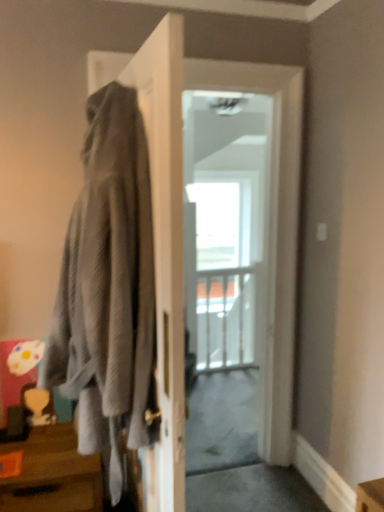
In order to face white glossy door at center, should I rotate leftwards or rightwards?

To align with it, rotate right about 1.968°.

What is the approximate width of transparent glass door at center?

3.12 inches.

Describe the element at coordinates (222, 270) in the screenshot. The width and height of the screenshot is (384, 512). I see `transparent glass door at center` at that location.

Locate an element on the screen. white glossy door at center is located at coordinates (182, 233).

Is white glossy door at center further to the viewer compared to gray textured hoodie at left?

Yes.

Is white glossy door at center inside or outside of gray textured hoodie at left?

white glossy door at center is spatially situated outside gray textured hoodie at left.

Could you tell me if white glossy door at center is facing gray textured hoodie at left?

No, white glossy door at center is not aimed at gray textured hoodie at left.

How far apart are transparent glass door at center and gray textured hoodie at left?

The distance of transparent glass door at center from gray textured hoodie at left is 3.00 meters.

Is transparent glass door at center turned away from gray textured hoodie at left?

That's not correct — transparent glass door at center is not looking away from gray textured hoodie at left.

Which is more to the left, transparent glass door at center or gray textured hoodie at left?

gray textured hoodie at left.

Image resolution: width=384 pixels, height=512 pixels. In order to click on glass door below the gray textured hoodie at left (from a real-world perspective) in this screenshot , I will do `click(222, 270)`.

Does white glossy door at center appear on the right side of brown wood table at lower left?

Indeed, white glossy door at center is positioned on the right side of brown wood table at lower left.

From a real-world perspective, which object rests below the other?

In real-world perspective, brown wood table at lower left is lower.

Which object is thinner, white glossy door at center or brown wood table at lower left?

white glossy door at center is thinner.

In the scene shown: How much distance is there between gray textured hoodie at left and white glossy door at center?

The distance of gray textured hoodie at left from white glossy door at center is 96.00 centimeters.

Considering the sizes of objects gray textured hoodie at left and white glossy door at center in the image provided, who is smaller, gray textured hoodie at left or white glossy door at center?

white glossy door at center.

From a real-world perspective, is gray textured hoodie at left located beneath white glossy door at center?

Actually, gray textured hoodie at left is physically above white glossy door at center in the real world.

Would you say gray textured hoodie at left is a long distance from white glossy door at center?

That's not correct — gray textured hoodie at left is a little close to white glossy door at center.

What's the angular difference between brown wood table at lower left and transparent glass door at center's facing directions?

The facing directions of brown wood table at lower left and transparent glass door at center are 1.34 degrees apart.

Which of these two, brown wood table at lower left or transparent glass door at center, is bigger?

transparent glass door at center is bigger.

Does brown wood table at lower left contain transparent glass door at center?

No, transparent glass door at center is located outside of brown wood table at lower left.

Is brown wood table at lower left not near transparent glass door at center?

Indeed, brown wood table at lower left is not near transparent glass door at center.

Which is more to the right, gray textured hoodie at left or transparent glass door at center?

transparent glass door at center is more to the right.

Relative to transparent glass door at center, is gray textured hoodie at left in front or behind?

In the image, gray textured hoodie at left appears in front of transparent glass door at center.

From a real-world perspective, does gray textured hoodie at left sit lower than transparent glass door at center?

No, from a real-world perspective, gray textured hoodie at left is not beneath transparent glass door at center.

Can we say gray textured hoodie at left lies outside transparent glass door at center?

Yes, gray textured hoodie at left is not within transparent glass door at center.

Is gray textured hoodie at left oriented away from brown wood table at lower left?

No.

From a real-world perspective, is gray textured hoodie at left positioned above or below brown wood table at lower left?

gray textured hoodie at left is above brown wood table at lower left.

From the image's perspective, is gray textured hoodie at left under brown wood table at lower left?

No.

Would you say brown wood table at lower left is part of gray textured hoodie at left's contents?

No.

Identify the location of laundry below the white glossy door at center (from the image's perspective). This screenshot has height=512, width=384. (108, 287).

This screenshot has width=384, height=512. Identify the location of laundry above the transparent glass door at center (from a real-world perspective). (108, 287).

Estimate the real-world distances between objects in this image. Which object is further from gray textured hoodie at left, white glossy door at center or brown wood table at lower left?

Based on the image, white glossy door at center appears to be further to gray textured hoodie at left.

When comparing their distances from white glossy door at center, does brown wood table at lower left or transparent glass door at center seem closer?

The object closer to white glossy door at center is brown wood table at lower left.

Which object lies further to the anchor point brown wood table at lower left, white glossy door at center or transparent glass door at center?

transparent glass door at center.

Looking at the image, which one is located closer to gray textured hoodie at left, white glossy door at center or transparent glass door at center?

Among the two, white glossy door at center is located nearer to gray textured hoodie at left.

From the image, which object appears to be nearer to white glossy door at center, brown wood table at lower left or gray textured hoodie at left?

gray textured hoodie at left is positioned closer to the anchor white glossy door at center.

When comparing their distances from brown wood table at lower left, does white glossy door at center or gray textured hoodie at left seem closer?

gray textured hoodie at left is closer to brown wood table at lower left.

Looking at the image, which one is located further to brown wood table at lower left, gray textured hoodie at left or transparent glass door at center?

Based on the image, transparent glass door at center appears to be further to brown wood table at lower left.

Which object lies further to the anchor point gray textured hoodie at left, transparent glass door at center or white glossy door at center?

transparent glass door at center.

Identify the location of laundry between white glossy door at center and brown wood table at lower left in the up-down direction. This screenshot has width=384, height=512. (108, 287).

Where is `door between brown wood table at lower left and transparent glass door at center from front to back`? Image resolution: width=384 pixels, height=512 pixels. door between brown wood table at lower left and transparent glass door at center from front to back is located at coordinates (182, 233).

Locate an element on the screen. table positioned between gray textured hoodie at left and transparent glass door at center from near to far is located at coordinates (52, 474).

At what (x,y) coordinates should I click in order to perform the action: click on door between gray textured hoodie at left and transparent glass door at center along the z-axis. Please return your answer as a coordinate pair (x, y). The width and height of the screenshot is (384, 512). Looking at the image, I should click on (182, 233).